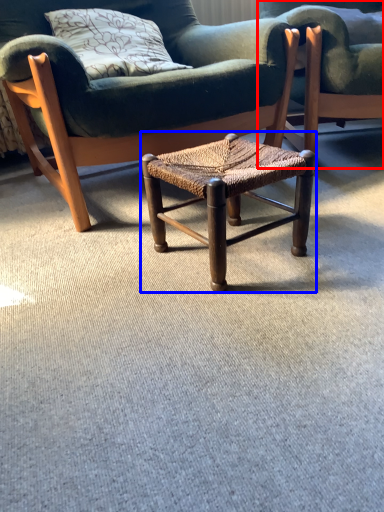
Question: Among these objects, which one is farthest to the camera, chair (highlighted by a red box) or stool (highlighted by a blue box)?

Choices:
 (A) chair
 (B) stool

Answer: (A)